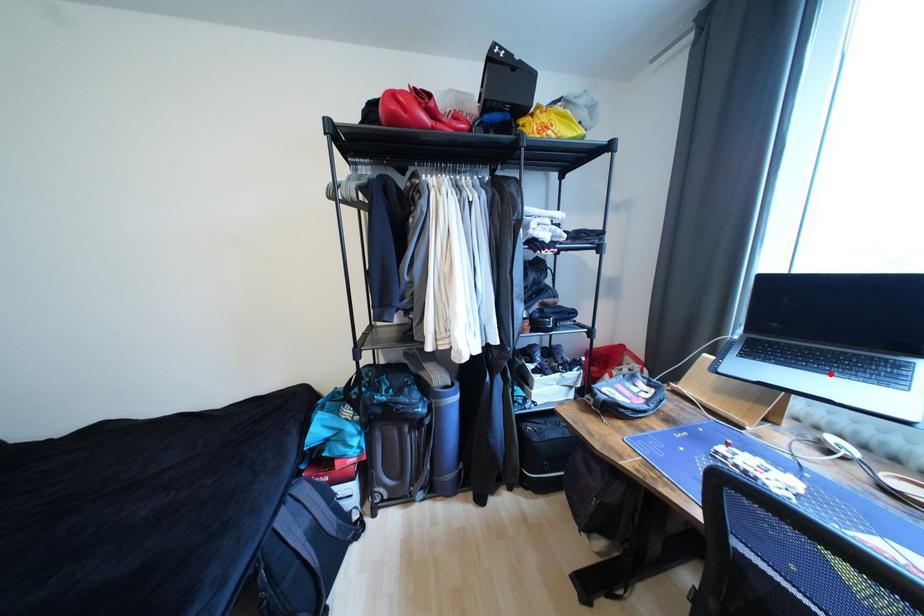
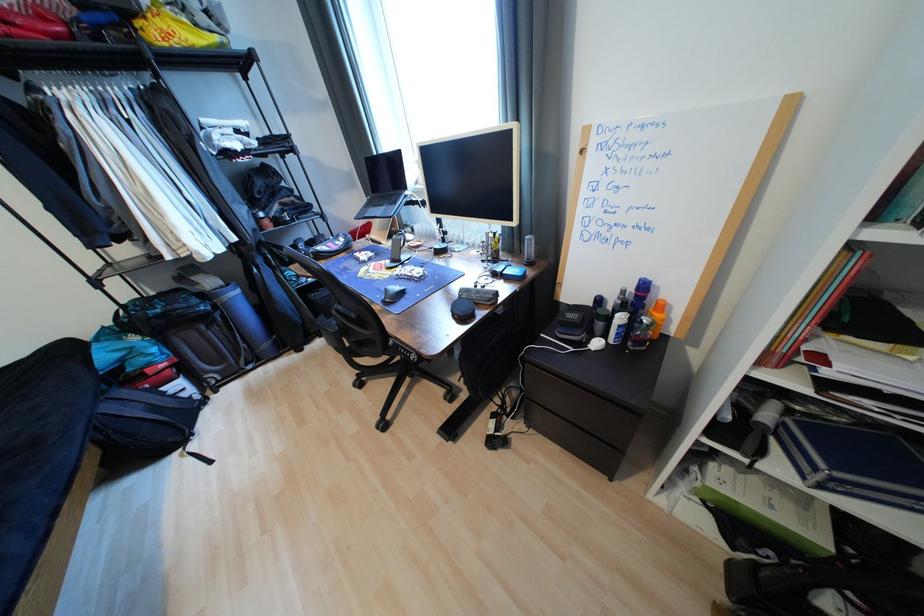
Where in the second image is the point corresponding to the highlighted location from the first image?

(388, 207)